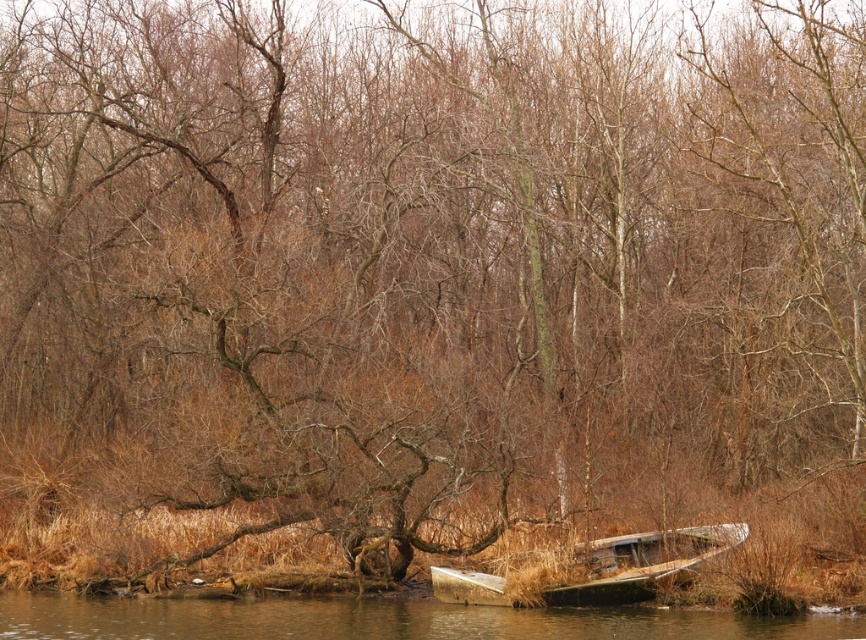
Who is shorter, brown wooden boat at lower center or rusty metal boat at lower right?

brown wooden boat at lower center is shorter.

Is brown wooden boat at lower center wider than rusty metal boat at lower right?

Yes, brown wooden boat at lower center is wider than rusty metal boat at lower right.

Image resolution: width=866 pixels, height=640 pixels. Describe the element at coordinates (382, 620) in the screenshot. I see `brown wooden boat at lower center` at that location.

The height and width of the screenshot is (640, 866). What are the coordinates of `brown wooden boat at lower center` in the screenshot? It's located at (382, 620).